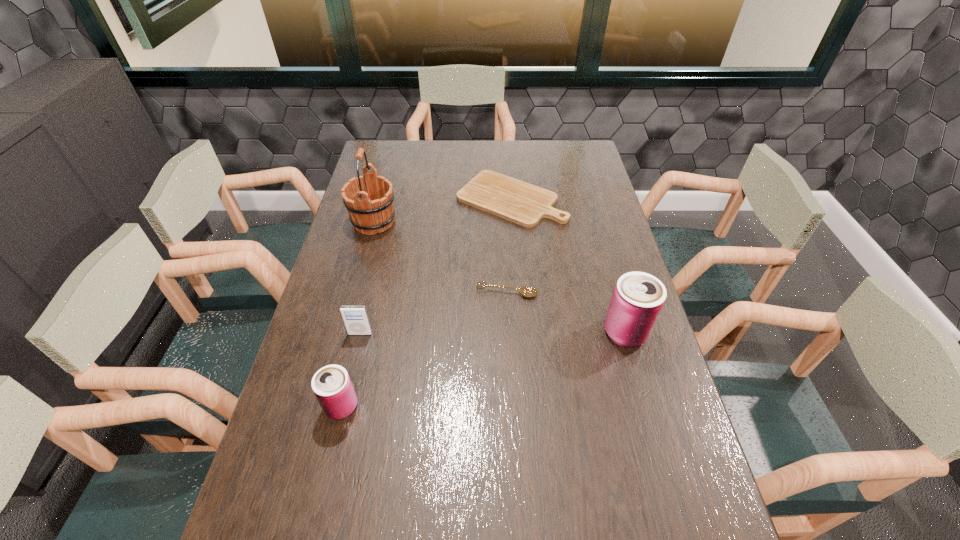
To ensure equal spacing by inserting another can among them, please point out a vacant spot for this new can. Please provide its 2D coordinates. Your answer should be formatted as a tuple, i.e. [(x, y)], where the tuple contains the x and y coordinates of a point satisfying the conditions above.

[(492, 367)]